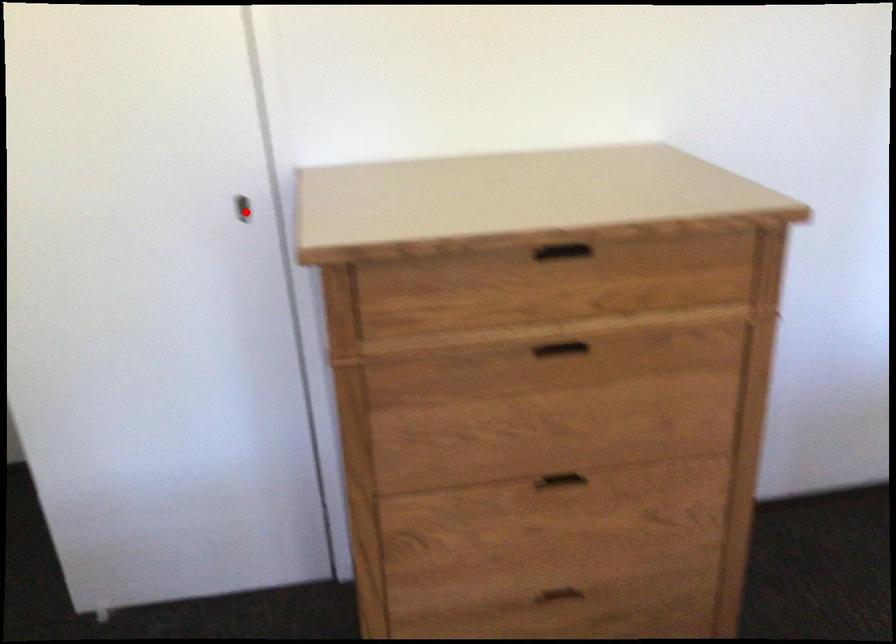
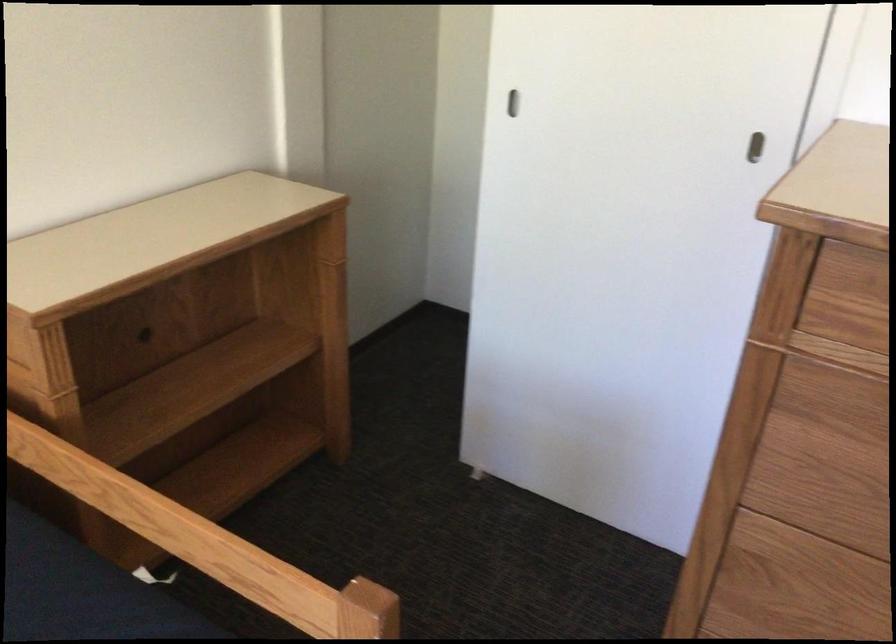
Question: I am providing you with two images of the same scene from different viewpoints. Image1 has a red point marked. In image2, the corresponding 3D location appears at what relative position? Reply with the corresponding letter.

Choices:
 (A) Closer
 (B) Farther

Answer: (A)